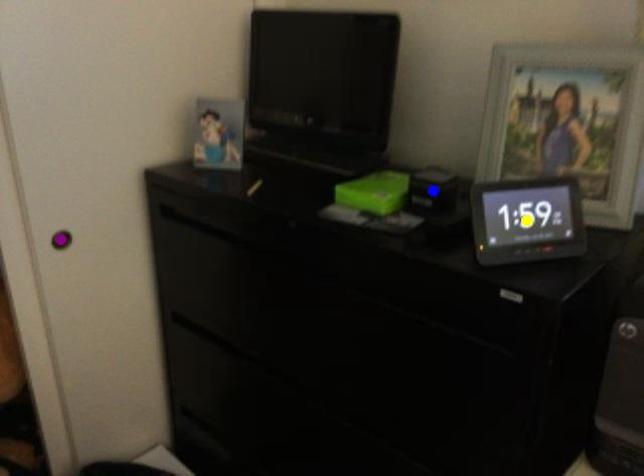
Order these from nearest to farthest:
- purple point
- blue point
- yellow point

yellow point
purple point
blue point